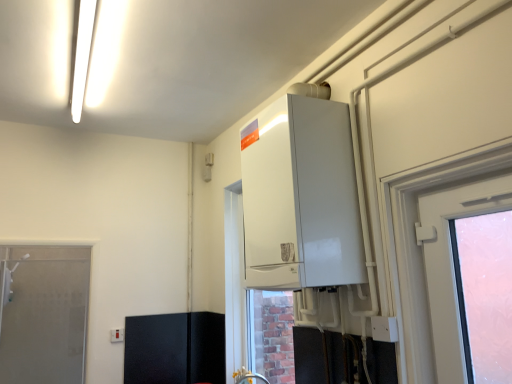
Question: Is black leather cabinet at lower left at the left side of white glossy boiler at upper center?

Choices:
 (A) no
 (B) yes

Answer: (B)

Question: Does black leather cabinet at lower left have a greater height compared to white glossy boiler at upper center?

Choices:
 (A) no
 (B) yes

Answer: (A)

Question: Is black leather cabinet at lower left at the right side of white glossy boiler at upper center?

Choices:
 (A) yes
 (B) no

Answer: (B)

Question: Is black leather cabinet at lower left wider than white glossy boiler at upper center?

Choices:
 (A) no
 (B) yes

Answer: (A)

Question: Is black leather cabinet at lower left facing away from white glossy boiler at upper center?

Choices:
 (A) yes
 (B) no

Answer: (B)

Question: Considering the relative positions of frosted glass door at left and white glossy boiler at upper center in the image provided, is frosted glass door at left to the left or to the right of white glossy boiler at upper center?

Choices:
 (A) right
 (B) left

Answer: (B)

Question: In terms of width, does frosted glass door at left look wider or thinner when compared to white glossy boiler at upper center?

Choices:
 (A) wide
 (B) thin

Answer: (B)

Question: Does point (68, 276) appear closer or farther from the camera than point (279, 162)?

Choices:
 (A) farther
 (B) closer

Answer: (A)

Question: In terms of size, does frosted glass door at left appear bigger or smaller than white glossy boiler at upper center?

Choices:
 (A) small
 (B) big

Answer: (A)

Question: Is matte silver faucet at lower center taller or shorter than black leather cabinet at lower left?

Choices:
 (A) short
 (B) tall

Answer: (A)

Question: Would you say matte silver faucet at lower center is inside or outside black leather cabinet at lower left?

Choices:
 (A) inside
 (B) outside

Answer: (B)

Question: Considering the positions of point (263, 377) and point (196, 349), is point (263, 377) closer or farther from the camera than point (196, 349)?

Choices:
 (A) closer
 (B) farther

Answer: (A)

Question: Relative to black leather cabinet at lower left, is matte silver faucet at lower center in front or behind?

Choices:
 (A) front
 (B) behind

Answer: (A)

Question: Is frosted glass door at left wider or thinner than matte silver faucet at lower center?

Choices:
 (A) wide
 (B) thin

Answer: (B)

Question: From their relative heights in the image, would you say frosted glass door at left is taller or shorter than matte silver faucet at lower center?

Choices:
 (A) tall
 (B) short

Answer: (A)